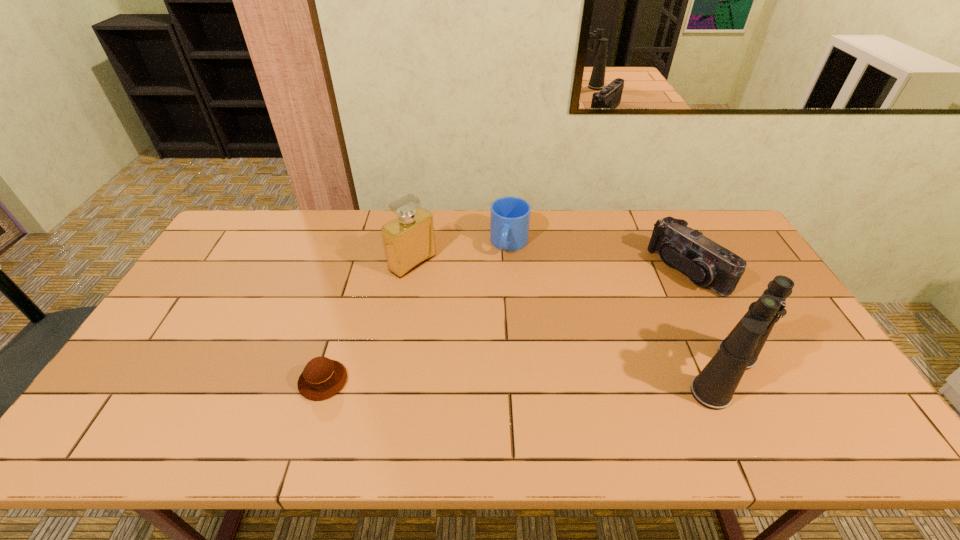
Find the location of a particular element. The height and width of the screenshot is (540, 960). free space on the desktop that is between the leftmost object and the tallest object and is positioned on the front-facing side of the fourth object from right to left is located at coordinates (580, 376).

Locate an element on the screen. Image resolution: width=960 pixels, height=540 pixels. vacant space on the desktop that is between the shortest object and the tallest object and is positioned on the front-facing side of the camcorder is located at coordinates (491, 378).

Identify the location of free space on the desktop that is between the leftmost object and the binoculars and is positioned on the side of the third object from left to right with the handle. (471, 379).